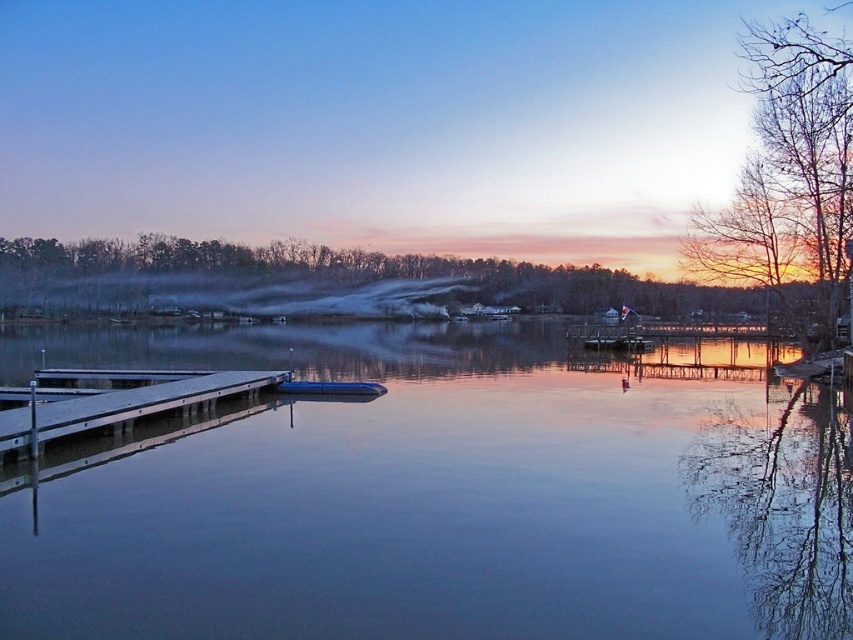
Question: From the image, what is the correct spatial relationship of brown matte tree at upper center in relation to metallic gray dock at lower left?

Choices:
 (A) left
 (B) right

Answer: (A)

Question: Is bare branches at right to the left of brown matte tree at upper center from the viewer's perspective?

Choices:
 (A) no
 (B) yes

Answer: (A)

Question: Which object is farther from the camera taking this photo?

Choices:
 (A) metallic gray dock at lower left
 (B) bare branches at right
 (C) brown matte tree at upper center

Answer: (C)

Question: Among these points, which one is farthest from the camera?

Choices:
 (A) (109, 380)
 (B) (436, 264)
 (C) (311, 397)

Answer: (B)

Question: Can you confirm if metallic gray dock at lower left is positioned to the left of blue rubber boat at center?

Choices:
 (A) no
 (B) yes

Answer: (B)

Question: Among these points, which one is nearest to the camera?

Choices:
 (A) (584, 294)
 (B) (846, 88)

Answer: (B)